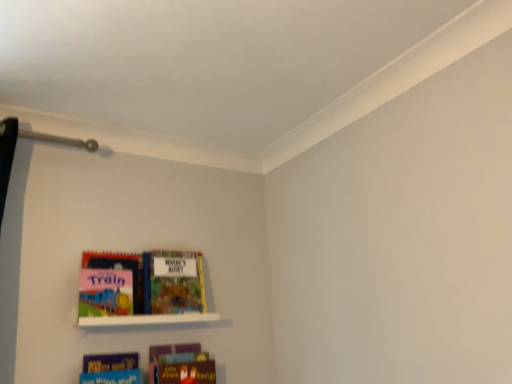
Locate an element on the screen. matte cardboard book at lower center, the first book in the bottom-to-top sequence is located at coordinates (179, 362).

At what (x,y) coordinates should I click in order to perform the action: click on matte board book at left, which ranks as the fourth book in bottom-to-top order. Please return your answer as a coordinate pair (x, y). The width and height of the screenshot is (512, 384). Looking at the image, I should click on (109, 284).

At what (x,y) coordinates should I click in order to perform the action: click on white matte shelf at lower left. Please return your answer as a coordinate pair (x, y). This screenshot has width=512, height=384. Looking at the image, I should click on (147, 319).

Who is smaller, multicolored cardboard book at center, which appears as the third book when ordered from the bottom, or matte board book at left, which ranks as the fourth book in bottom-to-top order?

matte board book at left, which ranks as the fourth book in bottom-to-top order.

Which object is thinner, multicolored cardboard book at center, positioned as the second book in top-to-bottom order, or matte board book at left, which ranks as the fourth book in bottom-to-top order?

Thinner between the two is matte board book at left, which ranks as the fourth book in bottom-to-top order.

How many degrees apart are the facing directions of multicolored cardboard book at center, positioned as the second book in top-to-bottom order, and matte board book at left, which ranks as the fourth book in bottom-to-top order?

0.0039 degrees separate the facing orientations of multicolored cardboard book at center, positioned as the second book in top-to-bottom order, and matte board book at left, which ranks as the fourth book in bottom-to-top order.

Find the location of a particular element. This screenshot has width=512, height=384. the 1st book located beneath the multicolored cardboard book at center, positioned as the second book in top-to-bottom order (from a real-world perspective) is located at coordinates (109, 284).

From the image's perspective, which one is positioned higher, matte cardboard book at lower center, the first book in the bottom-to-top sequence, or multicolored cardboard book at center, positioned as the second book in top-to-bottom order?

From the image's view, multicolored cardboard book at center, positioned as the second book in top-to-bottom order, is above.

Is point (170, 382) closer or farther from the camera than point (148, 296)?

Clearly, point (170, 382) is closer to the camera than point (148, 296).

Is multicolored cardboard book at center, positioned as the second book in top-to-bottom order, completely or partially inside matte cardboard book at lower center, the first book in the bottom-to-top sequence?

Definitely not — multicolored cardboard book at center, positioned as the second book in top-to-bottom order, is not inside matte cardboard book at lower center, the first book in the bottom-to-top sequence.

From a real-world perspective, between matte cardboard book at lower center, the first book in the bottom-to-top sequence, and multicolored cardboard book at center, which appears as the third book when ordered from the bottom, who is vertically lower?

In real-world perspective, matte cardboard book at lower center, the first book in the bottom-to-top sequence, is lower.

Does matte board book at left, which ranks as the fourth book in bottom-to-top order, turn towards white matte shelf at lower left?

No.

Does matte board book at left, the 1th book viewed from the top, have a larger size compared to white matte shelf at lower left?

Yes.

Does point (136, 291) come behind point (142, 320)?

Yes, point (136, 291) is behind point (142, 320).

Choose the correct answer: Is multicolored cardboard book at center, positioned as the second book in top-to-bottom order, inside matte cardboard book at lower center, placed as the fourth book when sorted from top to bottom, or outside it?

multicolored cardboard book at center, positioned as the second book in top-to-bottom order, exists outside the volume of matte cardboard book at lower center, placed as the fourth book when sorted from top to bottom.

Consider the image. Between multicolored cardboard book at center, positioned as the second book in top-to-bottom order, and matte cardboard book at lower center, the first book in the bottom-to-top sequence, which one has larger width?

multicolored cardboard book at center, positioned as the second book in top-to-bottom order.

Is multicolored cardboard book at center, which appears as the third book when ordered from the bottom, not close to matte cardboard book at lower center, placed as the fourth book when sorted from top to bottom?

They are positioned close to each other.

Which of these two, multicolored cardboard book at center, positioned as the second book in top-to-bottom order, or matte cardboard book at lower center, the first book in the bottom-to-top sequence, is smaller?

matte cardboard book at lower center, the first book in the bottom-to-top sequence, is smaller.

Is blue matte book at lower center, which is the 2th book from bottom to top, surrounded by multicolored cardboard book at center, positioned as the second book in top-to-bottom order?

No, blue matte book at lower center, which is the 2th book from bottom to top, is located outside of multicolored cardboard book at center, positioned as the second book in top-to-bottom order.

The image size is (512, 384). I want to click on the 1st book to the left of the multicolored cardboard book at center, positioned as the second book in top-to-bottom order, counting from the anchor's position, so click(x=111, y=369).

How different are the orientations of multicolored cardboard book at center, which appears as the third book when ordered from the bottom, and blue matte book at lower center, which is the 2th book from bottom to top, in degrees?

0.00193 degrees.

In the image, is multicolored cardboard book at center, which appears as the third book when ordered from the bottom, on the left side or the right side of blue matte book at lower center, placed as the third book when sorted from top to bottom?

Based on their positions, multicolored cardboard book at center, which appears as the third book when ordered from the bottom, is located to the right of blue matte book at lower center, placed as the third book when sorted from top to bottom.

How distant is matte board book at left, which ranks as the fourth book in bottom-to-top order, from matte cardboard book at lower center, placed as the fourth book when sorted from top to bottom?

A distance of 12.24 inches exists between matte board book at left, which ranks as the fourth book in bottom-to-top order, and matte cardboard book at lower center, placed as the fourth book when sorted from top to bottom.

Is point (105, 314) farther from camera compared to point (179, 375)?

That is False.

In terms of size, does matte board book at left, the 1th book viewed from the top, appear bigger or smaller than matte cardboard book at lower center, placed as the fourth book when sorted from top to bottom?

matte board book at left, the 1th book viewed from the top, is bigger than matte cardboard book at lower center, placed as the fourth book when sorted from top to bottom.

Are matte board book at left, which ranks as the fourth book in bottom-to-top order, and matte cardboard book at lower center, placed as the fourth book when sorted from top to bottom, located far from each other?

No.

Does matte board book at left, which ranks as the fourth book in bottom-to-top order, appear on the left side of blue matte book at lower center, which is the 2th book from bottom to top?

Indeed, matte board book at left, which ranks as the fourth book in bottom-to-top order, is positioned on the left side of blue matte book at lower center, which is the 2th book from bottom to top.

Which of these two, matte board book at left, which ranks as the fourth book in bottom-to-top order, or blue matte book at lower center, placed as the third book when sorted from top to bottom, is smaller?

blue matte book at lower center, placed as the third book when sorted from top to bottom, is smaller.

Can you confirm if matte board book at left, the 1th book viewed from the top, is taller than blue matte book at lower center, which is the 2th book from bottom to top?

Yes, matte board book at left, the 1th book viewed from the top, is taller than blue matte book at lower center, which is the 2th book from bottom to top.

From a real-world perspective, does matte board book at left, the 1th book viewed from the top, sit lower than blue matte book at lower center, placed as the third book when sorted from top to bottom?

Incorrect, from a real-world perspective, matte board book at left, the 1th book viewed from the top, is higher than blue matte book at lower center, placed as the third book when sorted from top to bottom.

From the image's perspective, count 1st books downward from the matte board book at left, which ranks as the fourth book in bottom-to-top order, and point to it. Please provide its 2D coordinates.

[(173, 282)]

Identify the location of book that is the 1st one when counting leftward from the matte cardboard book at lower center, placed as the fourth book when sorted from top to bottom. This screenshot has height=384, width=512. pos(173,282).

Which object lies further to the anchor point matte cardboard book at lower center, placed as the fourth book when sorted from top to bottom, white matte shelf at lower left or matte board book at left, the 1th book viewed from the top?

matte board book at left, the 1th book viewed from the top, is positioned further to the anchor matte cardboard book at lower center, placed as the fourth book when sorted from top to bottom.

From the image, which object appears to be farther from multicolored cardboard book at center, which appears as the third book when ordered from the bottom, white matte shelf at lower left or blue matte book at lower center, which is the 2th book from bottom to top?

blue matte book at lower center, which is the 2th book from bottom to top.

Looking at the image, which one is located closer to blue matte book at lower center, placed as the third book when sorted from top to bottom, matte board book at left, which ranks as the fourth book in bottom-to-top order, or matte cardboard book at lower center, placed as the fourth book when sorted from top to bottom?

The object closer to blue matte book at lower center, placed as the third book when sorted from top to bottom, is matte cardboard book at lower center, placed as the fourth book when sorted from top to bottom.

Estimate the real-world distances between objects in this image. Which object is further from matte cardboard book at lower center, the first book in the bottom-to-top sequence, multicolored cardboard book at center, positioned as the second book in top-to-bottom order, or blue matte book at lower center, placed as the third book when sorted from top to bottom?

multicolored cardboard book at center, positioned as the second book in top-to-bottom order.

Which object lies nearer to the anchor point white matte shelf at lower left, matte board book at left, the 1th book viewed from the top, or matte cardboard book at lower center, placed as the fourth book when sorted from top to bottom?

The object closer to white matte shelf at lower left is matte board book at left, the 1th book viewed from the top.

From the picture: From the image, which object appears to be farther from matte cardboard book at lower center, placed as the fourth book when sorted from top to bottom, blue matte book at lower center, which is the 2th book from bottom to top, or white matte shelf at lower left?

white matte shelf at lower left.

Looking at the image, which one is located further to matte cardboard book at lower center, the first book in the bottom-to-top sequence, blue matte book at lower center, placed as the third book when sorted from top to bottom, or multicolored cardboard book at center, which appears as the third book when ordered from the bottom?

multicolored cardboard book at center, which appears as the third book when ordered from the bottom, is further to matte cardboard book at lower center, the first book in the bottom-to-top sequence.

Considering their positions, is white matte shelf at lower left positioned further to multicolored cardboard book at center, which appears as the third book when ordered from the bottom, than matte cardboard book at lower center, the first book in the bottom-to-top sequence?

matte cardboard book at lower center, the first book in the bottom-to-top sequence.

I want to click on shelf between matte board book at left, which ranks as the fourth book in bottom-to-top order, and blue matte book at lower center, which is the 2th book from bottom to top, in the vertical direction, so click(147, 319).

This screenshot has height=384, width=512. In order to click on book between matte board book at left, the 1th book viewed from the top, and blue matte book at lower center, which is the 2th book from bottom to top, in the up-down direction in this screenshot , I will do `click(173, 282)`.

At what (x,y) coordinates should I click in order to perform the action: click on shelf between multicolored cardboard book at center, which appears as the third book when ordered from the bottom, and blue matte book at lower center, which is the 2th book from bottom to top, from top to bottom. Please return your answer as a coordinate pair (x, y). Looking at the image, I should click on (147, 319).

You are a GUI agent. You are given a task and a screenshot of the screen. Output one action in this format:
    pyautogui.click(x=<x>, y=<y>)
    Task: Click on the book between multicolored cardboard book at center, positioned as the second book in top-to-bottom order, and matte cardboard book at lower center, placed as the fourth book when sorted from top to bottom, in the vertical direction
    This screenshot has width=512, height=384.
    Given the screenshot: What is the action you would take?
    pyautogui.click(x=111, y=369)